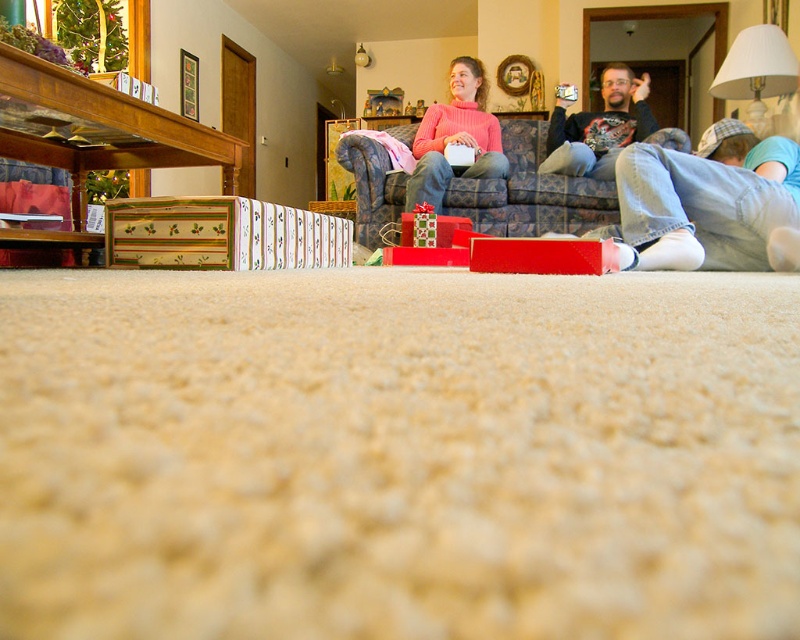
Which is above, patterned fabric couch at center or matte black shirt at center?

Positioned higher is matte black shirt at center.

Which is more to the left, patterned fabric couch at center or matte black shirt at center?

patterned fabric couch at center

Which is in front, point (605, 193) or point (580, 161)?

Point (605, 193)

Image resolution: width=800 pixels, height=640 pixels. I want to click on patterned fabric couch at center, so click(530, 192).

Does patterned fabric couch at center come behind matte pink sweater at center?

Yes.

Between point (521, 124) and point (436, 205), which one is positioned in front?

Point (436, 205)

Is point (466, 179) less distant than point (462, 100)?

Yes, it is.

The image size is (800, 640). Identify the location of patterned fabric couch at center. (530, 192).

Is matte pink sweater at center closer to the viewer compared to matte black shirt at center?

Yes, matte pink sweater at center is in front of matte black shirt at center.

Looking at this image, who is higher up, matte pink sweater at center or matte black shirt at center?

matte black shirt at center is higher up.

This screenshot has height=640, width=800. Identify the location of matte pink sweater at center. (454, 136).

What are the coordinates of `matte pink sweater at center` in the screenshot? It's located at (454, 136).